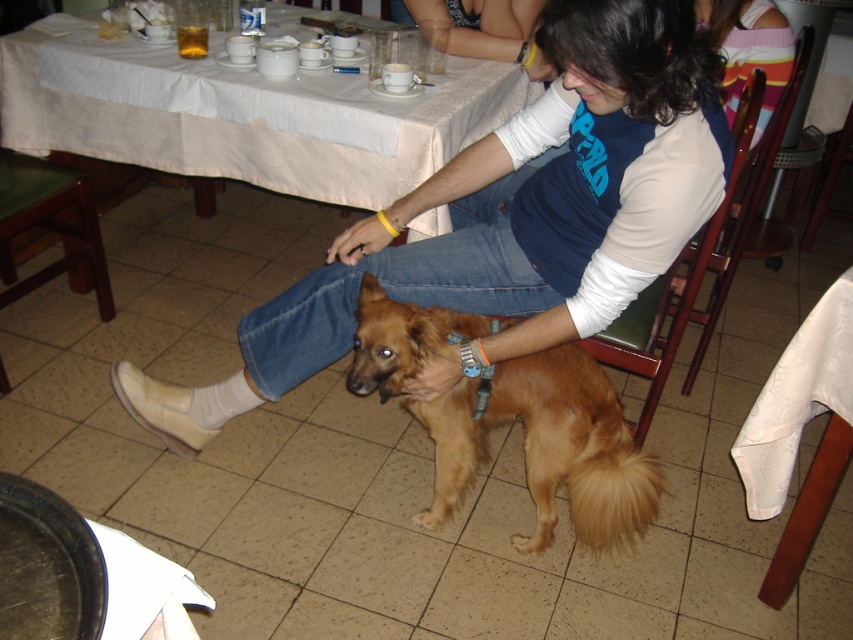
Question: Based on their relative distances, which object is farther from the white cloth-covered table at center?

Choices:
 (A) golden fur dog at center
 (B) striped sweater at upper right

Answer: (B)

Question: Which point is closer to the camera?

Choices:
 (A) brown denim jeans at center
 (B) white cloth-covered table at center
 (C) white fabric table at lower right

Answer: (A)

Question: Does white cloth-covered table at center appear under striped sweater at upper right?

Choices:
 (A) no
 (B) yes

Answer: (A)

Question: Is brown denim jeans at center further to camera compared to dark blue denim jeans at center?

Choices:
 (A) no
 (B) yes

Answer: (A)

Question: Which point is farther to the camera?

Choices:
 (A) white fabric table at lower right
 (B) brown denim jeans at center

Answer: (A)

Question: Can you confirm if white fabric table at lower right is thinner than striped sweater at upper right?

Choices:
 (A) yes
 (B) no

Answer: (A)